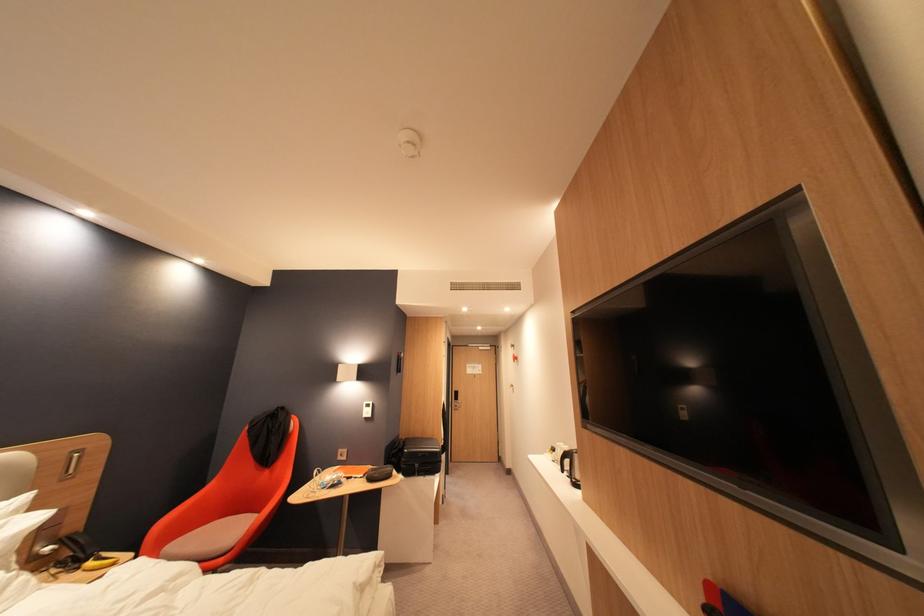
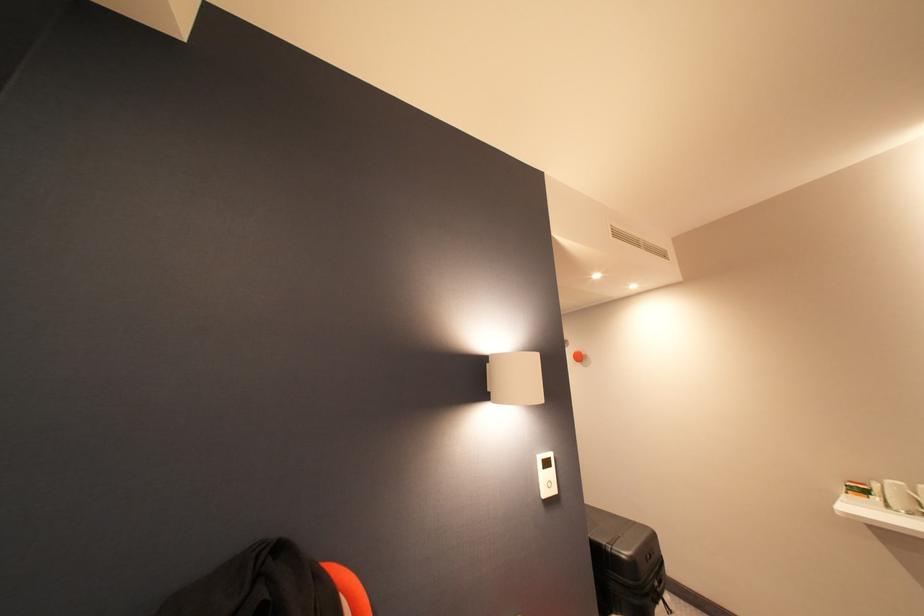
The images are taken continuously from a first-person perspective. In which direction are you moving?

The movement direction of the cameraman is left, forward.